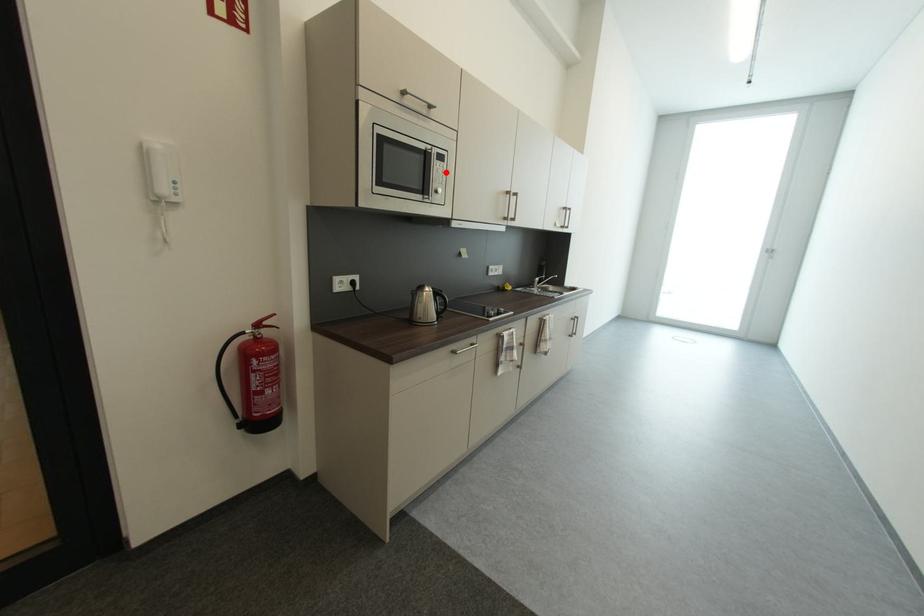
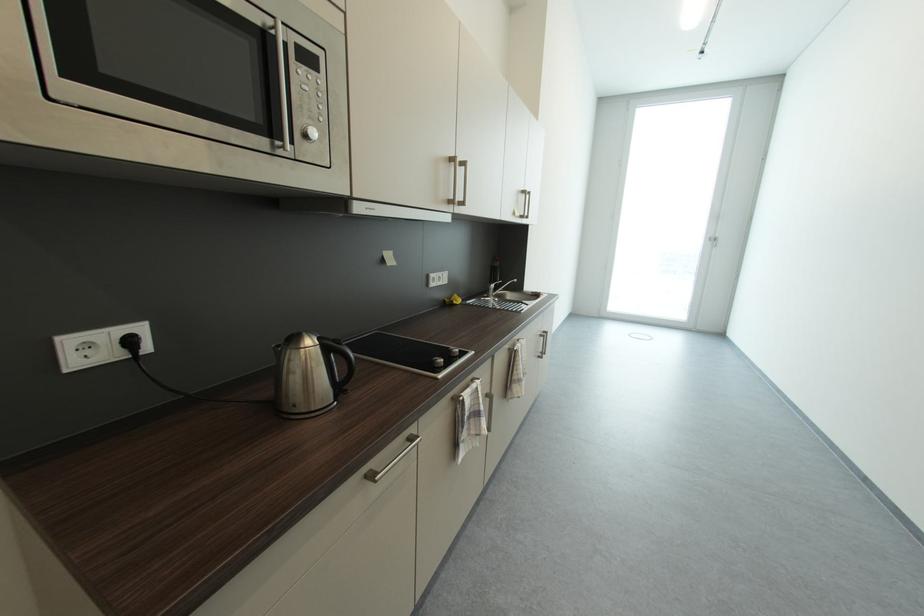
Find the pixel in the second image that matches the highlighted location in the first image.

(313, 89)